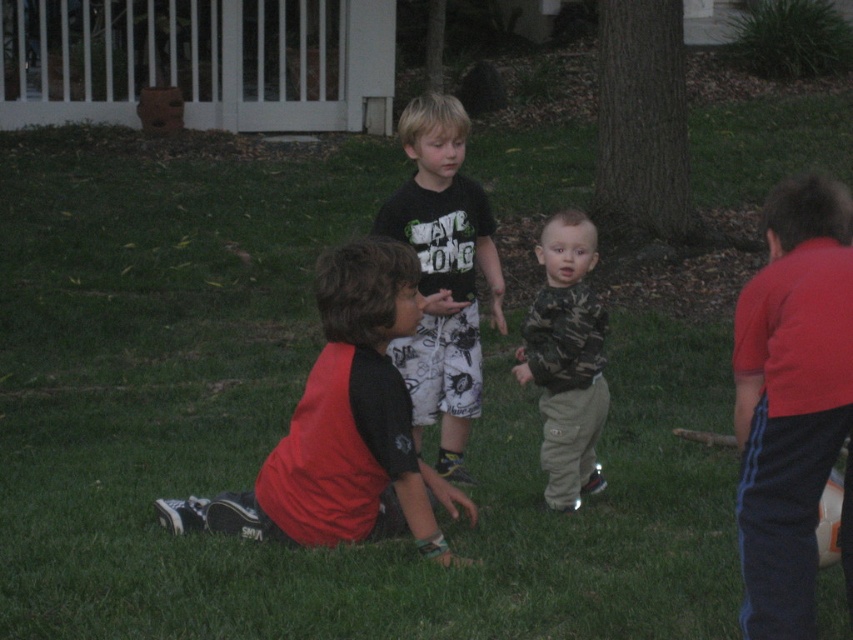
Question: Does red matte shirt at center have a greater width compared to camo fabric shirt at center?

Choices:
 (A) no
 (B) yes

Answer: (B)

Question: Does black printed t-shirt at center appear on the left side of camo fabric shirt at center?

Choices:
 (A) no
 (B) yes

Answer: (B)

Question: Estimate the real-world distances between objects in this image. Which object is farther from the camo fabric shirt at center?

Choices:
 (A) red matte shirt at center
 (B) black printed t-shirt at center

Answer: (A)

Question: Where is black printed t-shirt at center located in relation to camo fabric shirt at center in the image?

Choices:
 (A) left
 (B) right

Answer: (A)

Question: Which of these objects is positioned farthest from the red matte shirt at center?

Choices:
 (A) black printed t-shirt at center
 (B) camo fabric shirt at center

Answer: (A)

Question: Based on their relative distances, which object is nearer to the black printed t-shirt at center?

Choices:
 (A) camo fabric shirt at center
 (B) red matte shirt at center

Answer: (A)